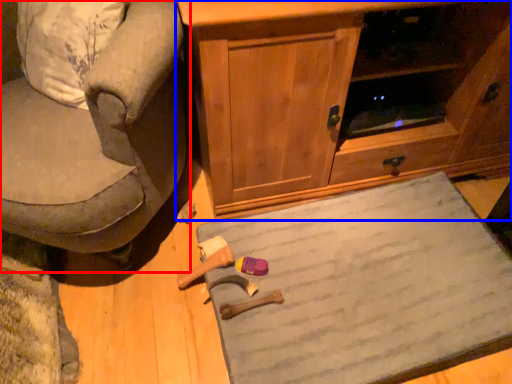
Question: Which object appears closest to the camera in this image, chair (highlighted by a red box) or cabinetry (highlighted by a blue box)?

Choices:
 (A) chair
 (B) cabinetry

Answer: (A)